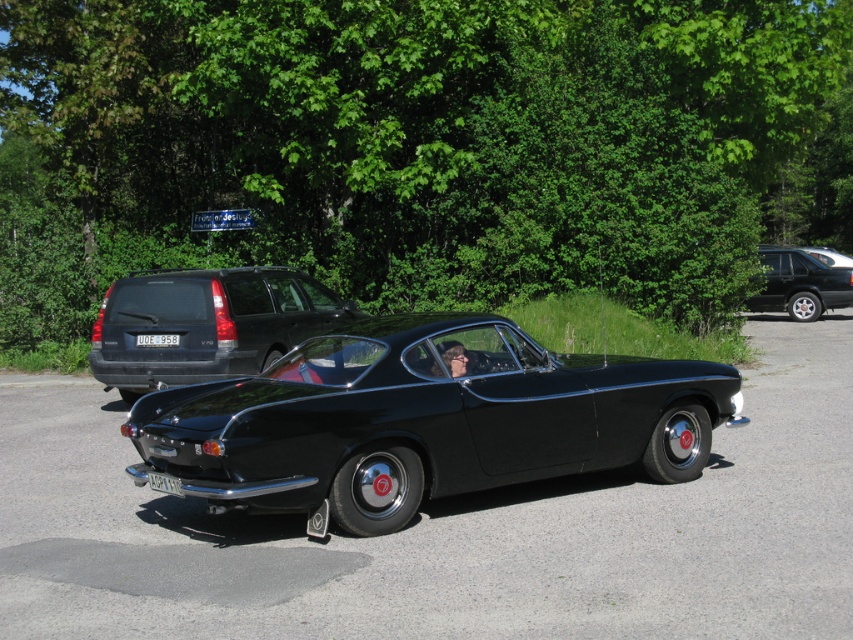
Question: Does white plastic license plate at lower center appear over white plastic license plate at center?

Choices:
 (A) no
 (B) yes

Answer: (A)

Question: Which object is positioned closest to the glossy black car at center?

Choices:
 (A) matte black car at center
 (B) white plastic license plate at lower center
 (C) shiny black suv at right

Answer: (C)

Question: Observing the image, what is the correct spatial positioning of matte black car at center in reference to glossy black car at center?

Choices:
 (A) above
 (B) below

Answer: (B)

Question: Estimate the real-world distances between objects in this image. Which object is farther from the matte black car at center?

Choices:
 (A) white plastic license plate at center
 (B) matte black suv at left
 (C) glossy black car at center

Answer: (C)

Question: Which object is farther from the camera taking this photo?

Choices:
 (A) glossy black car at center
 (B) matte black suv at left

Answer: (A)

Question: Is the position of black glossy car at center more distant than that of white plastic license plate at lower center?

Choices:
 (A) yes
 (B) no

Answer: (B)